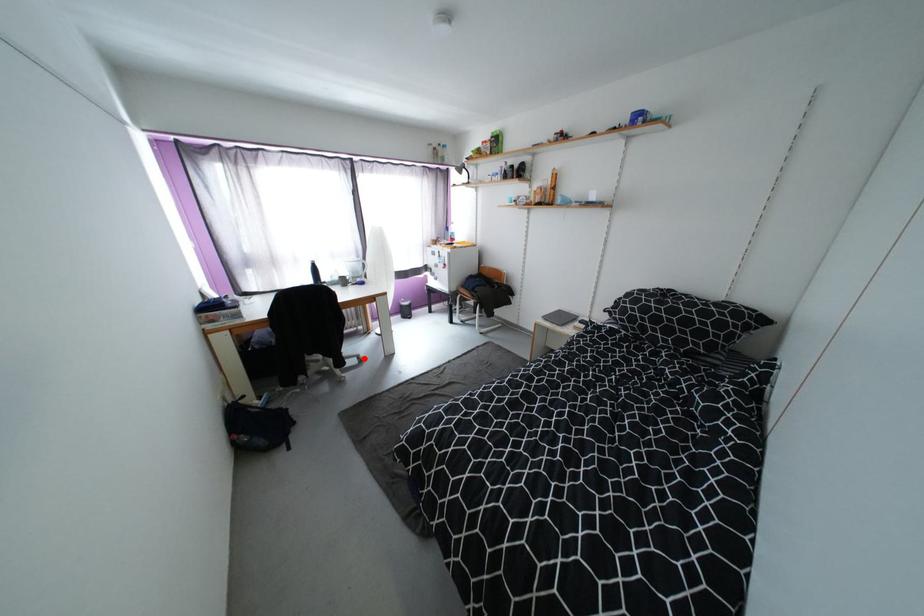
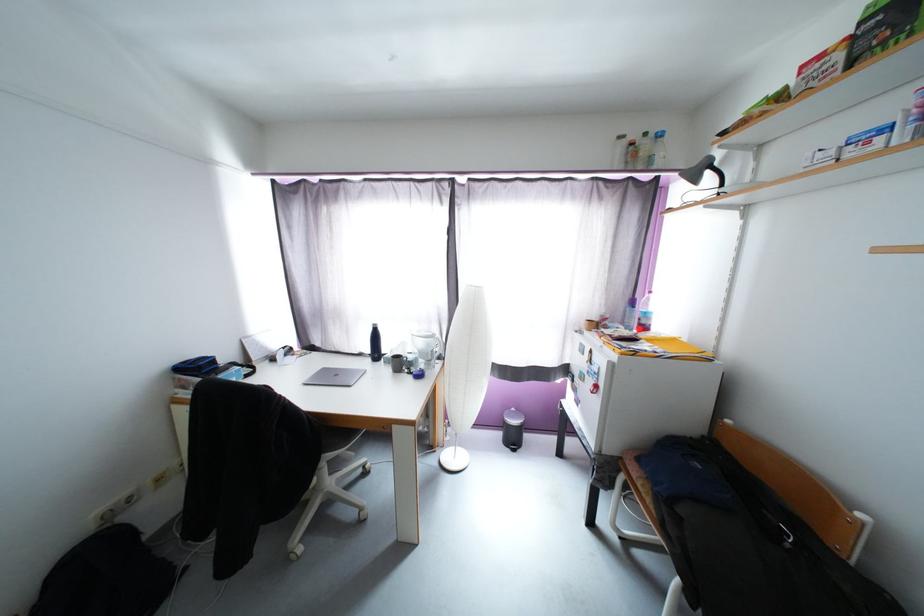
Question: I am providing you with two images of the same scene from different viewpoints. A red point is marked on the first image. At the location where the point appears in image 1, is it still visible in image 2?

Choices:
 (A) Yes
 (B) No

Answer: (A)